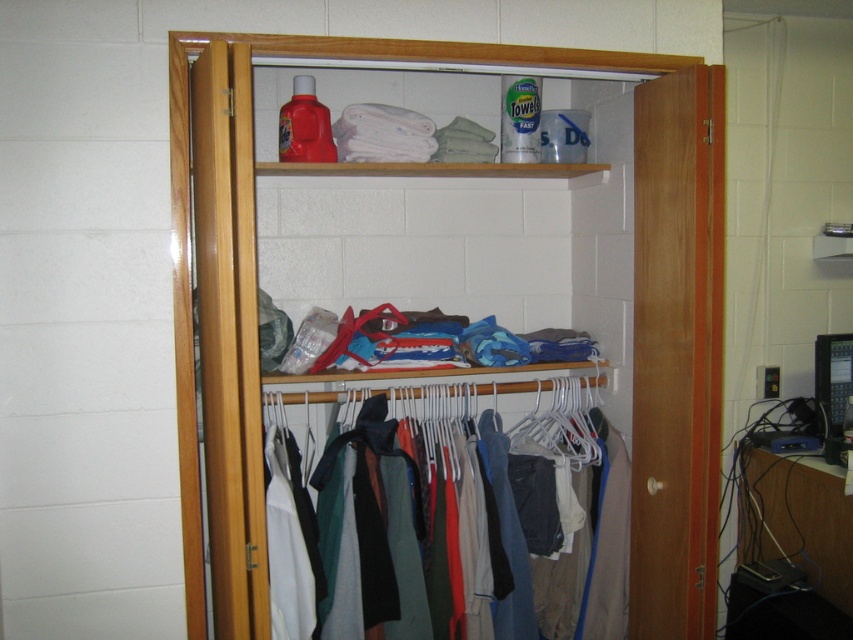
You are organizing the closet and need to place a new item on the shelf. The new item is wider than the space between the wooden hangers at center and the multicolored fabric clothes at center. Where should you place it to avoid blocking the entrance?

The wooden hangers at center are to the right of the multicolored fabric clothes at center. Since the new item is wider than the space between them, you should place it either to the left of the multicolored fabric clothes at center or to the right of the wooden hangers at center to avoid blocking the entrance.

You are trying to hang a new coat on the wooden hangers at center in the closet. However, the multicolored fabric clothes at center are already occupying the space. Can you hang the coat without removing any clothes?

The wooden hangers at center might be wider than multicolored fabric clothes at center, so there is a possibility that the coat can be hung without removing the clothes if the hangers provide enough space.